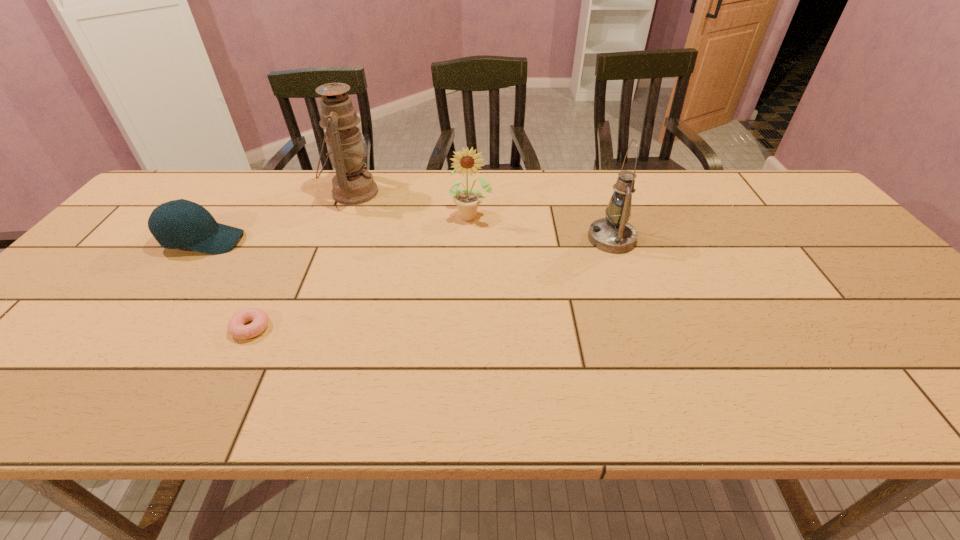
Locate an element on the screen. vacant space located on the left of the right oil lamp is located at coordinates (512, 239).

I want to click on vacant space positioned on the front-facing side of the third tallest object, so click(x=470, y=252).

Image resolution: width=960 pixels, height=540 pixels. In order to click on vacant space located 0.300m on the front-facing side of the leftmost object in this screenshot , I will do `click(352, 241)`.

Where is `free spot located on the right of the shortest object`? The image size is (960, 540). free spot located on the right of the shortest object is located at coordinates coord(414,328).

The height and width of the screenshot is (540, 960). I want to click on oil lamp that is at the far edge, so click(352, 185).

Where is `sunflower that is positioned at the far edge`? The height and width of the screenshot is (540, 960). sunflower that is positioned at the far edge is located at coordinates (467, 201).

You are a GUI agent. You are given a task and a screenshot of the screen. Output one action in this format:
    pyautogui.click(x=<x>, y=<y>)
    Task: Click on the object that is at the left edge
    Image resolution: width=960 pixels, height=540 pixels.
    Given the screenshot: What is the action you would take?
    pyautogui.click(x=178, y=224)

In the image, there is a desktop. Find the location of `vacant space at the far edge`. vacant space at the far edge is located at coordinates (680, 194).

This screenshot has height=540, width=960. Find the location of `free point at the near edge`. free point at the near edge is located at coordinates (719, 381).

Where is `vacant area at the left edge`? The image size is (960, 540). vacant area at the left edge is located at coordinates (12, 372).